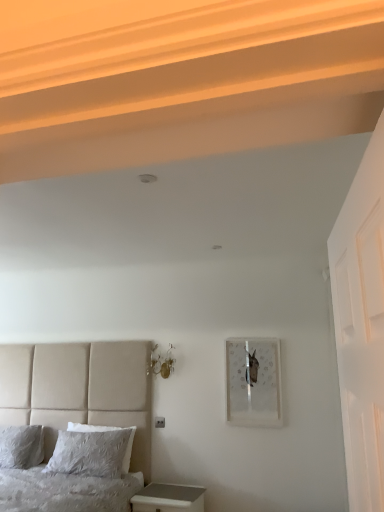
Question: Does metallic glass sconces at upper center have a greater width compared to textured gray pillow at lower left, which is the 1th bed from back to front?

Choices:
 (A) yes
 (B) no

Answer: (B)

Question: Can you confirm if metallic glass sconces at upper center is taller than textured gray pillow at lower left, which is the 1th bed from back to front?

Choices:
 (A) yes
 (B) no

Answer: (B)

Question: Could you tell me if metallic glass sconces at upper center is turned towards textured gray pillow at lower left, the 2th bed positioned from the front?

Choices:
 (A) yes
 (B) no

Answer: (B)

Question: From the image's perspective, does metallic glass sconces at upper center appear higher than textured gray pillow at lower left, which is the 1th bed from back to front?

Choices:
 (A) no
 (B) yes

Answer: (B)

Question: Is metallic glass sconces at upper center far away from textured gray pillow at lower left, the 2th bed positioned from the front?

Choices:
 (A) yes
 (B) no

Answer: (A)

Question: Does metallic glass sconces at upper center have a lesser height compared to textured gray pillow at lower left, which is the 1th bed from back to front?

Choices:
 (A) no
 (B) yes

Answer: (B)

Question: Is textured gray pillow at lower left, the 2th bed positioned from the front, beside metallic glass sconces at upper center?

Choices:
 (A) no
 (B) yes

Answer: (A)

Question: Is textured gray pillow at lower left, which is the 1th bed from back to front, outside metallic glass sconces at upper center?

Choices:
 (A) yes
 (B) no

Answer: (A)

Question: From the image's perspective, would you say textured gray pillow at lower left, the 2th bed positioned from the front, is shown under metallic glass sconces at upper center?

Choices:
 (A) yes
 (B) no

Answer: (A)

Question: From a real-world perspective, is textured gray pillow at lower left, which is the 1th bed from back to front, physically above metallic glass sconces at upper center?

Choices:
 (A) yes
 (B) no

Answer: (B)

Question: Is textured gray pillow at lower left, which is the 1th bed from back to front, not near metallic glass sconces at upper center?

Choices:
 (A) yes
 (B) no

Answer: (A)

Question: Can you confirm if textured gray pillow at lower left, the 2th bed positioned from the front, is wider than metallic glass sconces at upper center?

Choices:
 (A) yes
 (B) no

Answer: (A)

Question: Is metallic glass sconces at upper center surrounding matte glass picture frame at upper right?

Choices:
 (A) no
 (B) yes

Answer: (A)